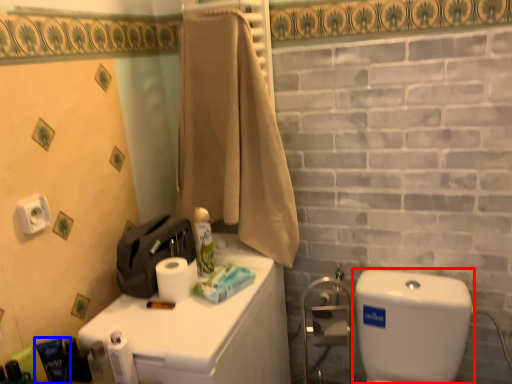
Question: Which point is further to the camera, water tank (highlighted by a red box) or toiletry (highlighted by a blue box)?

Choices:
 (A) water tank
 (B) toiletry

Answer: (B)